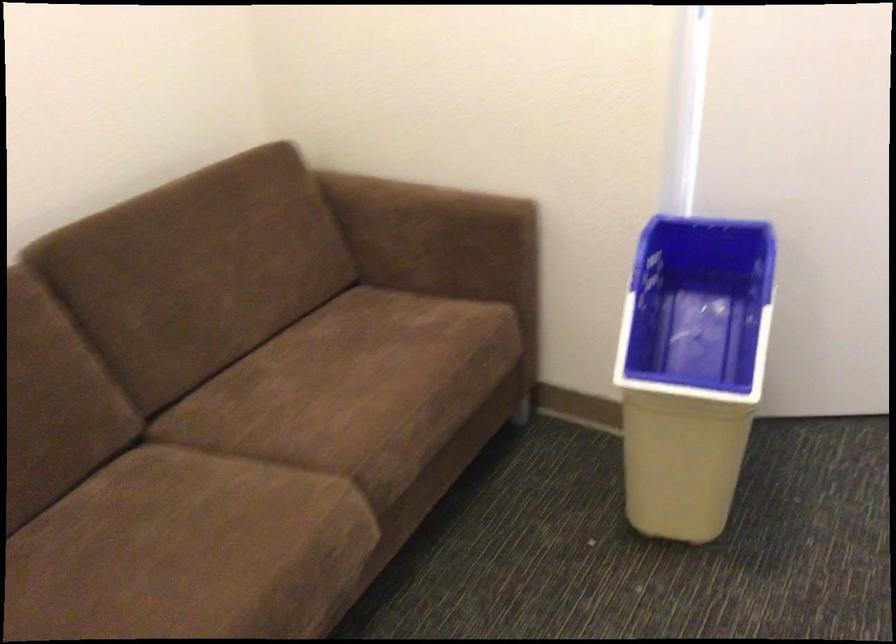
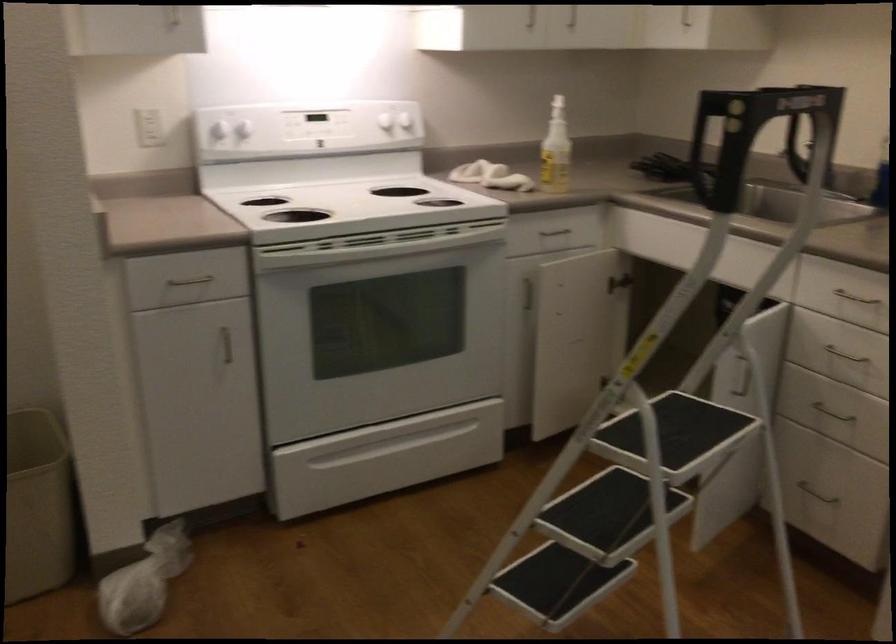
How did the camera likely rotate?

The rotation direction of the camera is left-down.